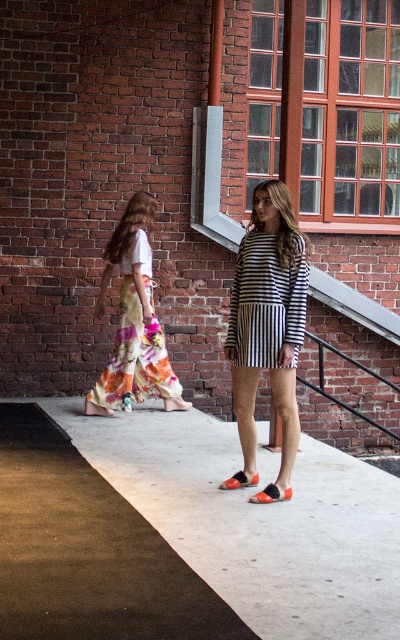
Based on the photo, you are standing on the concrete sidewalk at center and want to walk towards the floral cotton skirt at left. Which direction should you face?

The concrete sidewalk at center is to the right of floral cotton skirt at left, so you should face left to walk towards the floral cotton skirt at left.

You are standing on the concrete sidewalk at center and want to take a photo of the striped cotton dress at center. Which direction should you move to get the dress fully in frame?

The concrete sidewalk at center is in front of the striped cotton dress at center, so you should move backward to get the striped cotton dress at center fully in frame.

You are standing at point 0.5, 0.5 in the image. You need to walk to the concrete sidewalk at center. Which direction should you move to reach it?

The concrete sidewalk at center is located at point (182, 536). Since you are at (200, 320), you should move towards the northeast direction to reach it.